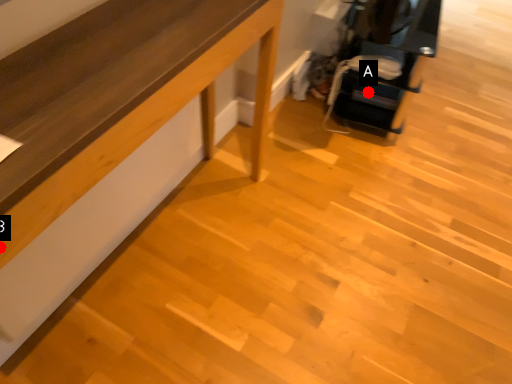
Question: Two points are circled on the image, labeled by A and B beside each circle. Among these points, which one is farthest from the camera?

Choices:
 (A) A is further
 (B) B is further

Answer: (A)